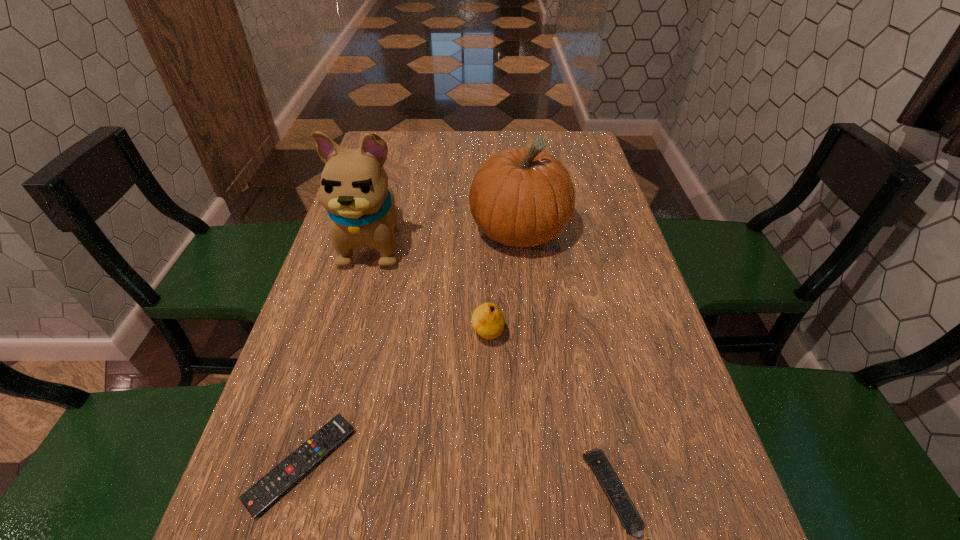
You are a GUI agent. You are given a task and a screenshot of the screen. Output one action in this format:
    pyautogui.click(x=<x>, y=<y>)
    Task: Click on the puppy
    
    Given the screenshot: What is the action you would take?
    pyautogui.click(x=354, y=190)

Image resolution: width=960 pixels, height=540 pixels. What are the coordinates of `the fourth shortest object` in the screenshot? It's located at (520, 197).

At what (x,y) coordinates should I click in order to perform the action: click on the third farthest object. Please return your answer as a coordinate pair (x, y). The width and height of the screenshot is (960, 540). Looking at the image, I should click on (488, 321).

The width and height of the screenshot is (960, 540). Find the location of `the third tallest object`. the third tallest object is located at coordinates (488, 321).

Find the location of `the right remote control`. the right remote control is located at coordinates (632, 522).

Find the location of a particular element. The image size is (960, 540). the second shortest object is located at coordinates (632, 522).

Locate an element on the screen. The width and height of the screenshot is (960, 540). the shortest object is located at coordinates (258, 498).

Identify the location of the shorter remote control. The height and width of the screenshot is (540, 960). (258, 498).

Locate an element on the screen. The height and width of the screenshot is (540, 960). free space located on the face of the puppy is located at coordinates (338, 376).

At what (x,y) coordinates should I click in order to perform the action: click on free space located 0.290m on the stem of the fourth shortest object. Please return your answer as a coordinate pair (x, y). Looking at the image, I should click on (533, 365).